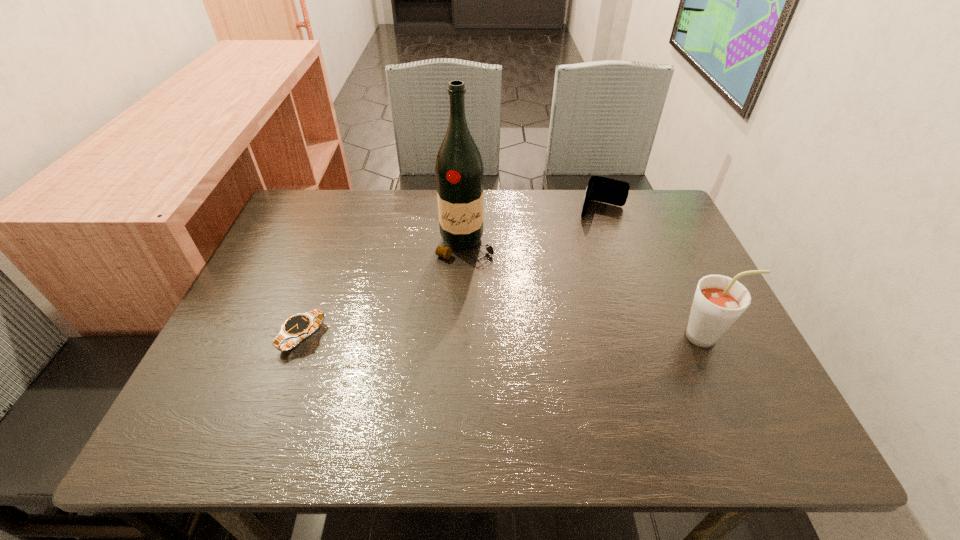
Locate an element on the screen. The height and width of the screenshot is (540, 960). blank area in the image that satisfies the following two spatial constraints: 1. on the front side of the second object from left to right; 2. on the drink side of the third shortest object is located at coordinates (462, 336).

I want to click on vacant point that satisfies the following two spatial constraints: 1. on the back side of the wallet; 2. on the right side of the watch, so click(x=348, y=210).

At what (x,y) coordinates should I click in order to perform the action: click on free region that satisfies the following two spatial constraints: 1. on the front side of the root beer; 2. on the drink side of the third object from left to right. Please return your answer as a coordinate pair (x, y). Looking at the image, I should click on (644, 336).